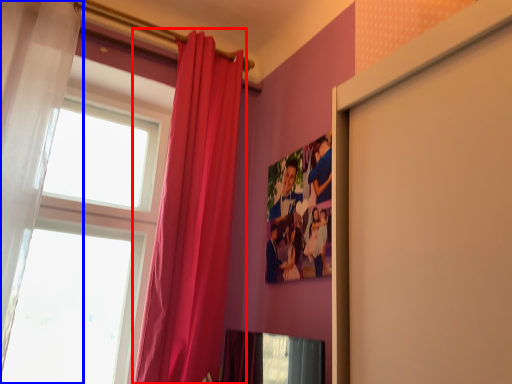
Question: Among these objects, which one is farthest to the camera, curtain (highlighted by a red box) or curtain (highlighted by a blue box)?

Choices:
 (A) curtain
 (B) curtain

Answer: (A)